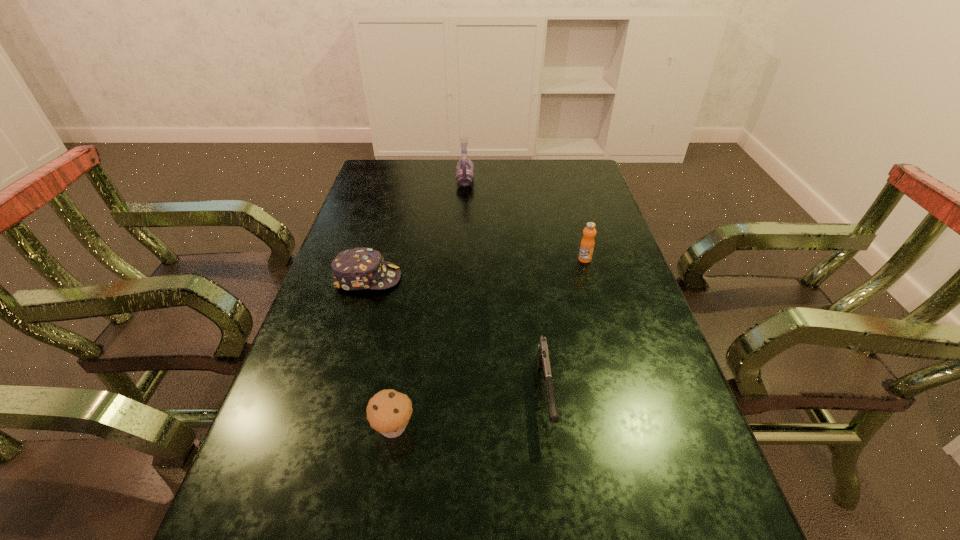
Where is `the tallest object`? This screenshot has width=960, height=540. the tallest object is located at coordinates (465, 167).

Locate an element on the screen. The height and width of the screenshot is (540, 960). headset is located at coordinates (465, 167).

Where is `orange juice`? orange juice is located at coordinates (587, 244).

The image size is (960, 540). I want to click on the rightmost object, so click(x=587, y=244).

Identify the location of the leftmost object. This screenshot has height=540, width=960. (360, 268).

Where is `muffin`? This screenshot has height=540, width=960. muffin is located at coordinates (388, 412).

Where is `the fourth object from left to right`? The width and height of the screenshot is (960, 540). the fourth object from left to right is located at coordinates (542, 357).

Where is `free space located on the headband and ear cups of the tallest object`? This screenshot has width=960, height=540. free space located on the headband and ear cups of the tallest object is located at coordinates [493, 180].

The image size is (960, 540). Identify the location of free region located 0.170m on the front label of the second tallest object. (598, 306).

I want to click on free space located 0.250m on the front-facing side of the headwear, so click(x=493, y=278).